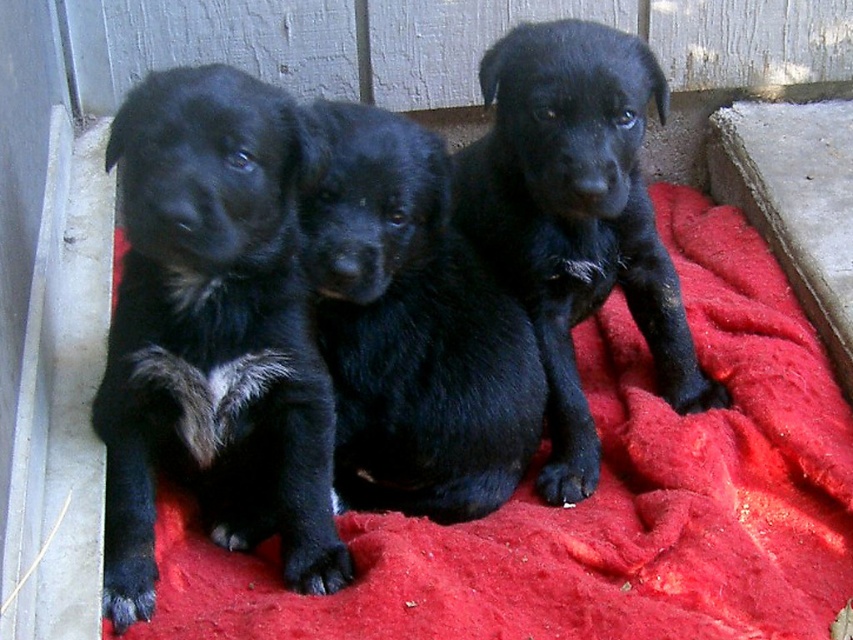
Question: Is red fleece dog bed at center further to camera compared to matte black puppy at center?

Choices:
 (A) yes
 (B) no

Answer: (B)

Question: Is red fleece dog bed at center smaller than matte black puppy at center?

Choices:
 (A) no
 (B) yes

Answer: (A)

Question: Does red fleece dog bed at center appear over black fur puppy at left?

Choices:
 (A) no
 (B) yes

Answer: (A)

Question: Which object appears farthest from the camera in this image?

Choices:
 (A) red fleece dog bed at center
 (B) black fur puppy at left

Answer: (A)

Question: Among these objects, which one is farthest from the camera?

Choices:
 (A) red fleece dog bed at center
 (B) black furry dog at center
 (C) black fur puppy at left
 (D) matte black puppy at center

Answer: (D)

Question: Which object is farther from the camera taking this photo?

Choices:
 (A) black furry dog at center
 (B) red fleece dog bed at center
 (C) black fur puppy at left

Answer: (A)